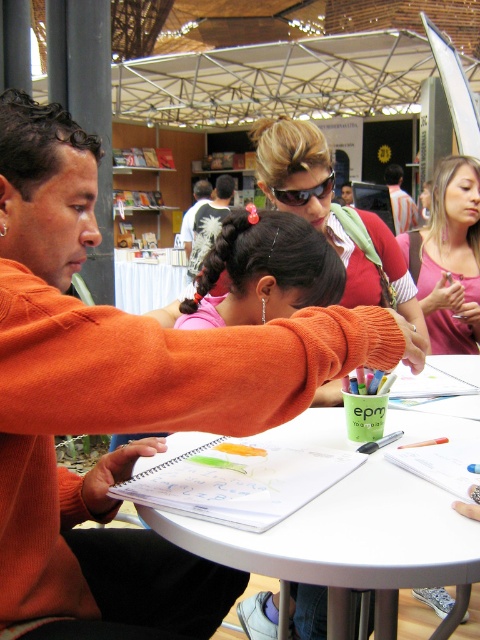
You are organizing a small gathering and need to place a white plastic table at center and a white feathered shirt at center in a room. Based on the scene description, which object takes up more space?

The white feathered shirt at center takes up more space than the white plastic table at center, as the white plastic table at center occupies less space according to the description.